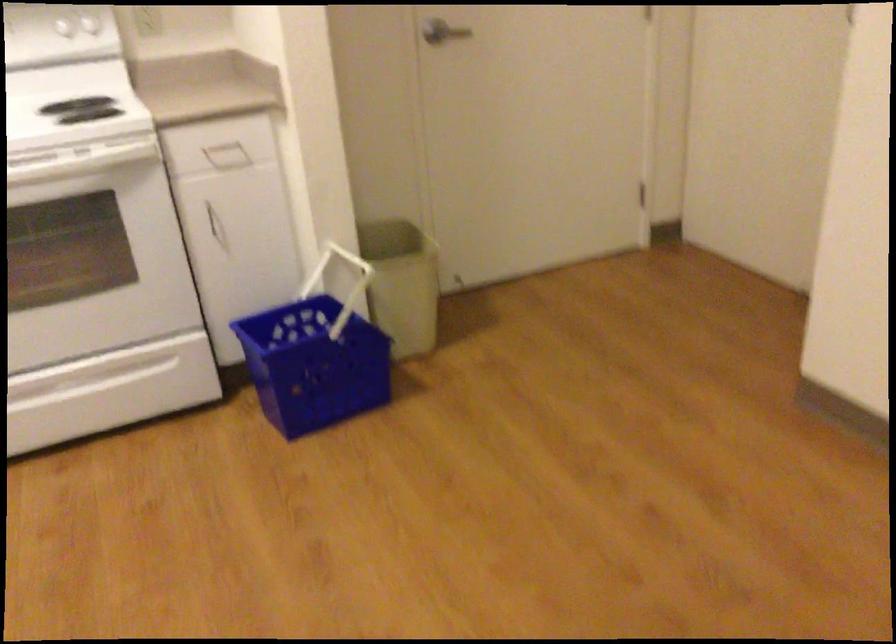
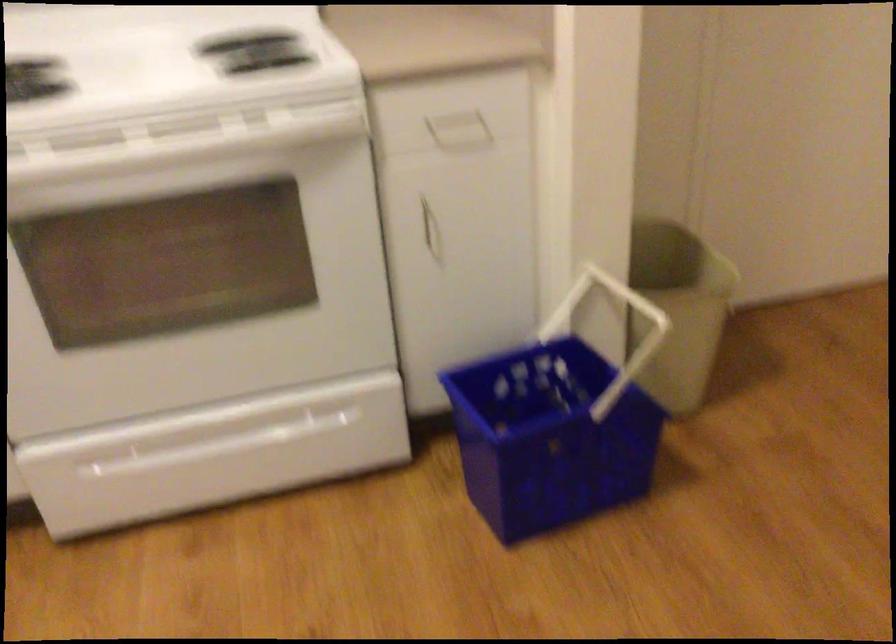
Question: I am providing you with two images of the same scene from different viewpoints. Which of the following objects are not visible in image2?

Choices:
 (A) oven drawer handle
 (B) beige trash can
 (C) white cabinet handle
 (D) none of these

Answer: (D)